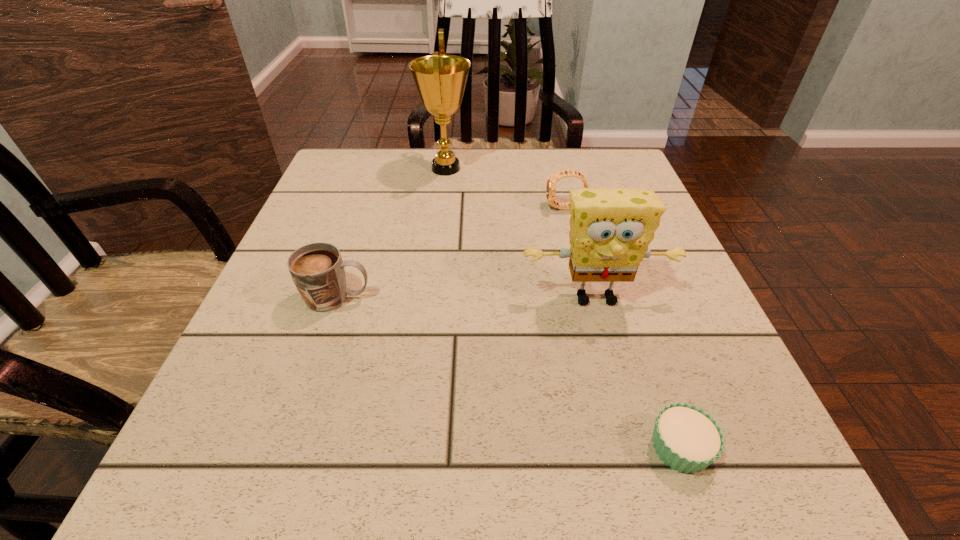
Locate an element on the screen. The width and height of the screenshot is (960, 540). object that is at the near right corner is located at coordinates (687, 439).

Locate an element on the screen. Image resolution: width=960 pixels, height=540 pixels. free space at the far edge is located at coordinates (472, 170).

At what (x,y) coordinates should I click in order to perform the action: click on vacant space at the near edge of the desktop. Please return your answer as a coordinate pair (x, y). Looking at the image, I should click on (584, 442).

In the image, there is a desktop. Find the location of `vacant region at the left edge`. vacant region at the left edge is located at coordinates (353, 199).

This screenshot has height=540, width=960. Find the location of `vacant space at the right edge of the desktop`. vacant space at the right edge of the desktop is located at coordinates (743, 407).

Image resolution: width=960 pixels, height=540 pixels. In order to click on vacant area at the far left corner in this screenshot , I will do click(x=390, y=151).

Locate an element on the screen. free space at the near right corner of the desktop is located at coordinates (697, 481).

Where is `vacant space in between the farthest object and the shortest object`? vacant space in between the farthest object and the shortest object is located at coordinates (563, 308).

This screenshot has height=540, width=960. I want to click on free point between the cupcake and the leftmost object, so click(509, 373).

Where is `vacant area between the award and the second farthest object`? vacant area between the award and the second farthest object is located at coordinates (506, 188).